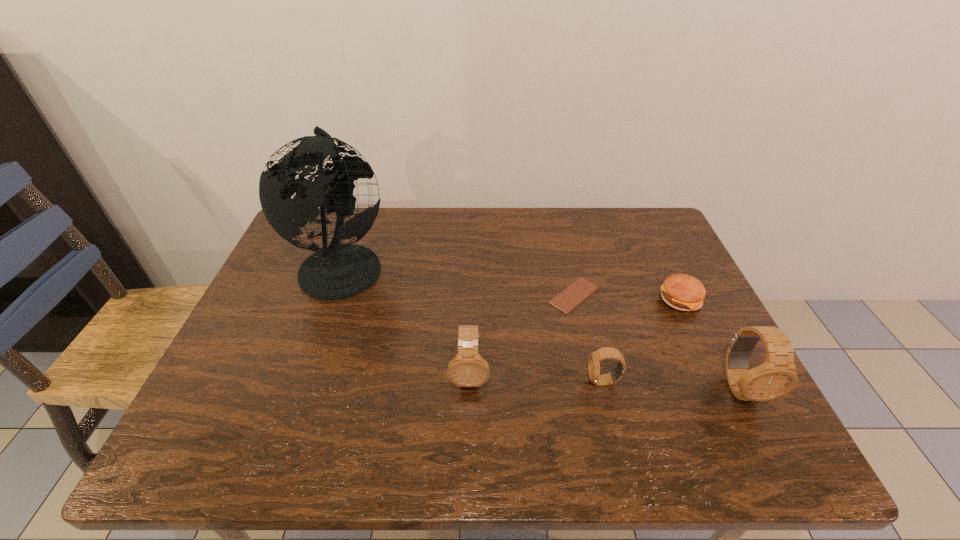
Please point a free position for a watch on the left. Please provide its 2D coordinates. Your answer should be formatted as a tuple, i.e. [(x, y)], where the tuple contains the x and y coordinates of a point satisfying the conditions above.

[(339, 370)]